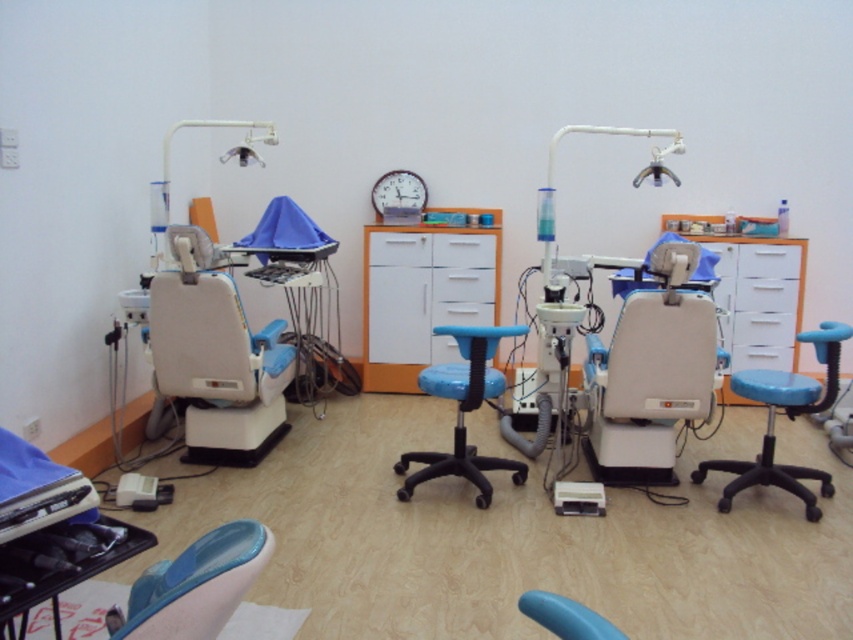
You are a dental assistant standing in the middle of the room and need to place a tray of tools between the two dental chairs. The tray has to be placed exactly at one of the two points marked as point 1 at point (448, 356) or point 2 at point (374, 211). Which point is closer to you so that you can easily reach it without moving?

Point 1 at point (448, 356) is closer to the viewer, so placing the tray there would be easier to reach without moving.

You are a dental assistant in a clinic. You need to move a tray of tools from the sink to the translucent blue swivel chair at lower left. The sink is located at the point with coordinates (196, 584). Is the sink closer to the translucent blue swivel chair at lower left than the other dental chair?

The point (196, 584) marks the translucent blue swivel chair at lower left, so the sink is located exactly at the chair, meaning the sink is right at the translucent blue swivel chair at lower left. Therefore, the sink is as close as possible to the chair and not closer to the other dental chair.

You are a patient entering the dental office and see the blue fabric stool at center and the blue plastic chair at lower center. Which object is positioned closer to the entrance of the room?

The blue fabric stool at center is closer to the entrance because the blue plastic chair at lower center is behind it, meaning the stool is in front and nearer to where you are standing.